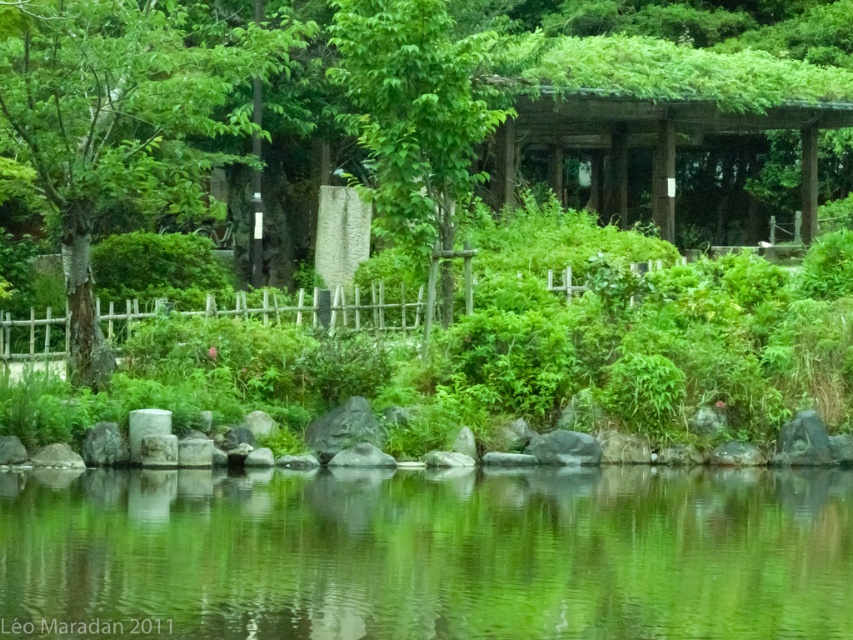
Does point (769, 77) come behind point (351, 32)?

Yes, point (769, 77) is behind point (351, 32).

Does green moss-covered gazebo at upper center appear over green leafy tree at center?

Yes, green moss-covered gazebo at upper center is above green leafy tree at center.

Locate an element on the screen. The width and height of the screenshot is (853, 640). green moss-covered gazebo at upper center is located at coordinates pos(648,100).

Where is `green moss-covered gazebo at upper center`? This screenshot has height=640, width=853. green moss-covered gazebo at upper center is located at coordinates (648, 100).

Which is below, green reflective water at center or green leafy bush at center?

green reflective water at center is below.

Who is positioned more to the right, green reflective water at center or green leafy bush at center?

From the viewer's perspective, green leafy bush at center appears more on the right side.

Locate an element on the screen. This screenshot has width=853, height=640. green reflective water at center is located at coordinates (430, 554).

Identify the location of green reflective water at center. The width and height of the screenshot is (853, 640). (430, 554).

Which is more to the right, green leafy bush at center or green leafy tree at left?

green leafy bush at center is more to the right.

Which is above, green leafy bush at center or green leafy tree at left?

green leafy tree at left is higher up.

Between point (606, 362) and point (228, 154), which one is positioned in front?

Point (606, 362) is more forward.

Where is `green leafy bush at center`? green leafy bush at center is located at coordinates (508, 346).